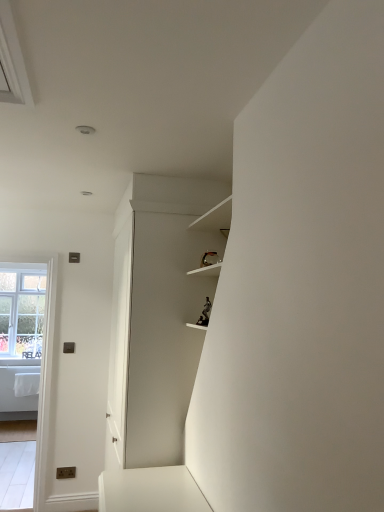
Question: From the image's perspective, is clear glass window at left on white matte cabinet at center?

Choices:
 (A) yes
 (B) no

Answer: (B)

Question: Is clear glass window at left oriented away from white matte cabinet at center?

Choices:
 (A) no
 (B) yes

Answer: (A)

Question: Can you confirm if clear glass window at left is positioned to the left of white matte cabinet at center?

Choices:
 (A) no
 (B) yes

Answer: (B)

Question: Is there a large distance between clear glass window at left and white matte cabinet at center?

Choices:
 (A) yes
 (B) no

Answer: (A)

Question: Does clear glass window at left have a larger size compared to white matte cabinet at center?

Choices:
 (A) no
 (B) yes

Answer: (A)

Question: Would you say clear glass window at left is to the left or to the right of white matte cabinet at center in the picture?

Choices:
 (A) right
 (B) left

Answer: (B)

Question: From their relative heights in the image, would you say clear glass window at left is taller or shorter than white matte cabinet at center?

Choices:
 (A) short
 (B) tall

Answer: (A)

Question: Is clear glass window at left inside the boundaries of white matte cabinet at center, or outside?

Choices:
 (A) inside
 (B) outside

Answer: (B)

Question: From the image's perspective, is clear glass window at left located above or below white matte cabinet at center?

Choices:
 (A) below
 (B) above

Answer: (A)

Question: Is clear glass window at left bigger or smaller than clear glass window at left?

Choices:
 (A) small
 (B) big

Answer: (B)

Question: Is clear glass window at left wider or thinner than clear glass window at left?

Choices:
 (A) wide
 (B) thin

Answer: (A)

Question: Considering the relative positions of clear glass window at left and clear glass window at left in the image provided, is clear glass window at left to the left or to the right of clear glass window at left?

Choices:
 (A) right
 (B) left

Answer: (B)

Question: From a real-world perspective, relative to clear glass window at left, is clear glass window at left vertically above or below?

Choices:
 (A) above
 (B) below

Answer: (A)

Question: Does point (38, 504) appear closer or farther from the camera than point (14, 346)?

Choices:
 (A) farther
 (B) closer

Answer: (B)

Question: From the image's perspective, is clear glass window at left above or below clear glass window at left?

Choices:
 (A) below
 (B) above

Answer: (A)